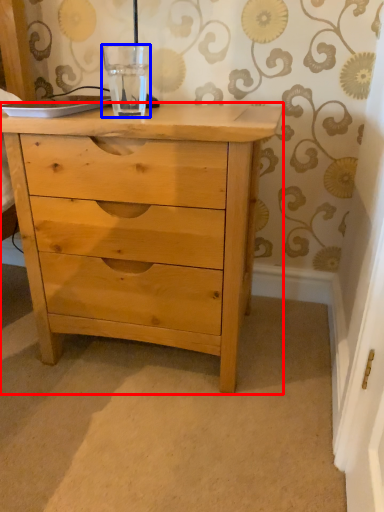
Question: Which object is closer to the camera taking this photo, chest of drawers (highlighted by a red box) or glass vase (highlighted by a blue box)?

Choices:
 (A) chest of drawers
 (B) glass vase

Answer: (A)